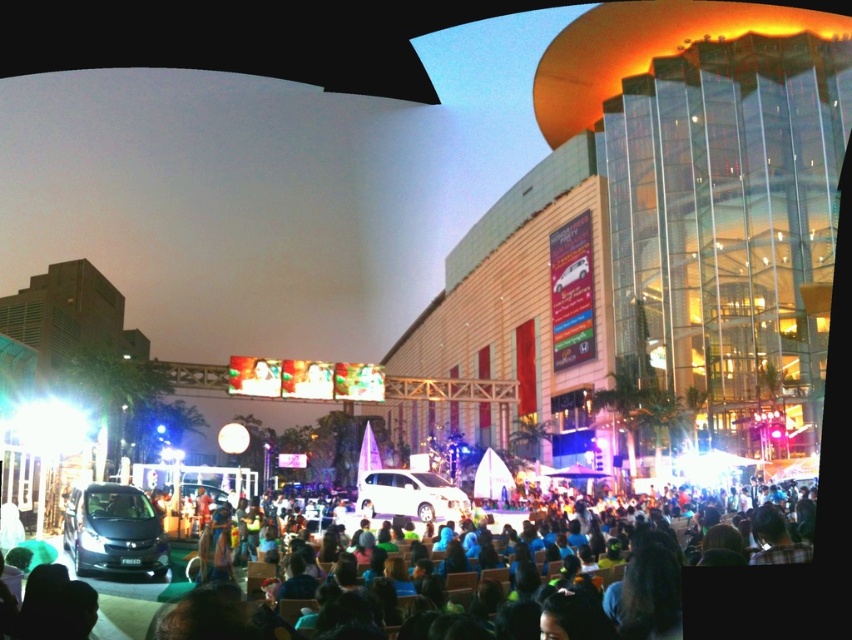
Question: Based on their relative distances, which object is nearer to the green fabric crowd at lower center?

Choices:
 (A) white glossy minivan at center
 (B) shiny black minivan at lower left

Answer: (B)

Question: Which object is farther from the camera taking this photo?

Choices:
 (A) green fabric crowd at lower center
 (B) white glossy minivan at center
 (C) shiny black minivan at lower left

Answer: (B)

Question: Can you confirm if green fabric crowd at lower center is smaller than white glossy minivan at center?

Choices:
 (A) no
 (B) yes

Answer: (A)

Question: Does green fabric crowd at lower center appear over shiny black minivan at lower left?

Choices:
 (A) no
 (B) yes

Answer: (A)

Question: Based on their relative distances, which object is farther from the shiny black minivan at lower left?

Choices:
 (A) white glossy minivan at center
 (B) green fabric crowd at lower center

Answer: (A)

Question: Can you confirm if green fabric crowd at lower center is bigger than white glossy minivan at center?

Choices:
 (A) yes
 (B) no

Answer: (A)